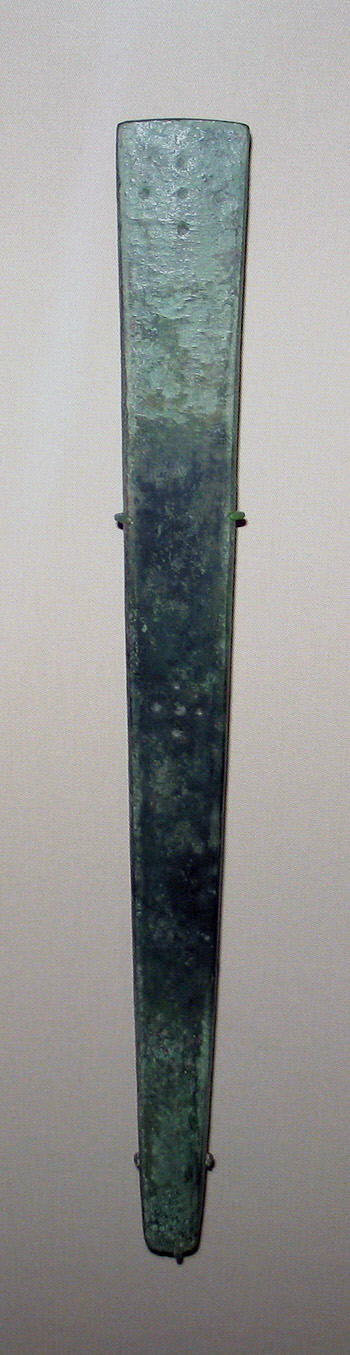
Locate an element on the screen. wall to right of art piece is located at coordinates (321, 439).